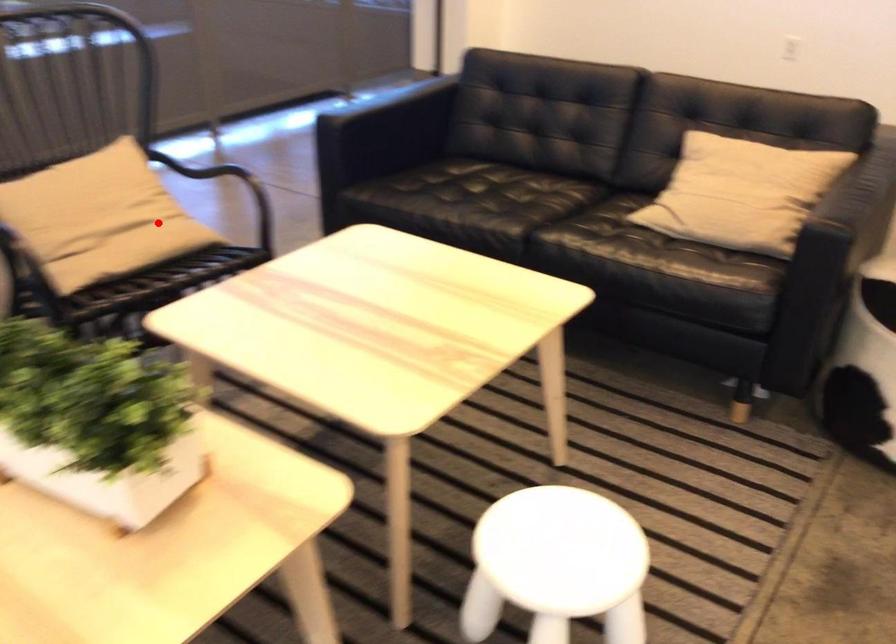
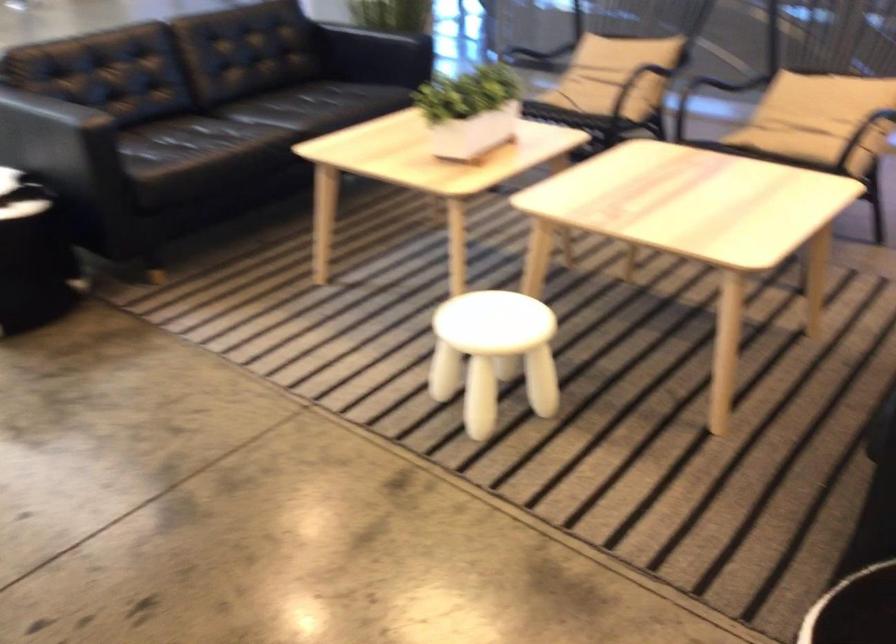
In the second image, find the point that corresponds to the highlighted location in the first image.

(817, 118)